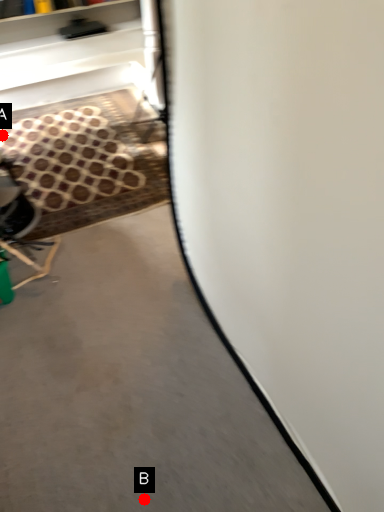
Question: Two points are circled on the image, labeled by A and B beside each circle. Which point is closer to the camera taking this photo?

Choices:
 (A) A is closer
 (B) B is closer

Answer: (B)